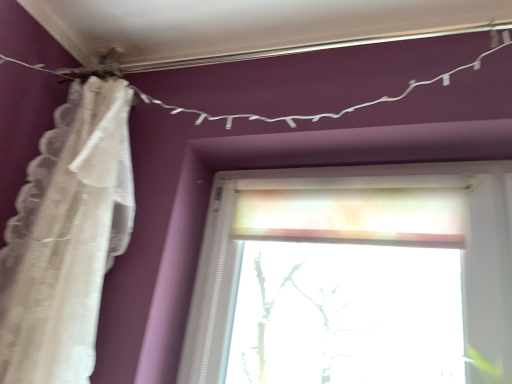
Question: Is point (354, 104) closer or farther from the camera than point (118, 160)?

Choices:
 (A) closer
 (B) farther

Answer: (B)

Question: From a real-world perspective, relative to white lace curtain at left, is white string lights at upper center vertically above or below?

Choices:
 (A) below
 (B) above

Answer: (B)

Question: Based on their sizes in the image, would you say white string lights at upper center is bigger or smaller than white lace curtain at left?

Choices:
 (A) small
 (B) big

Answer: (A)

Question: Is white lace curtain at left bigger or smaller than white string lights at upper center?

Choices:
 (A) big
 (B) small

Answer: (A)

Question: Relative to white string lights at upper center, is white lace curtain at left in front or behind?

Choices:
 (A) front
 (B) behind

Answer: (A)

Question: From a real-world perspective, is white lace curtain at left physically located above or below white string lights at upper center?

Choices:
 (A) below
 (B) above

Answer: (A)

Question: Based on their positions, is white lace curtain at left located to the left or right of white string lights at upper center?

Choices:
 (A) right
 (B) left

Answer: (B)